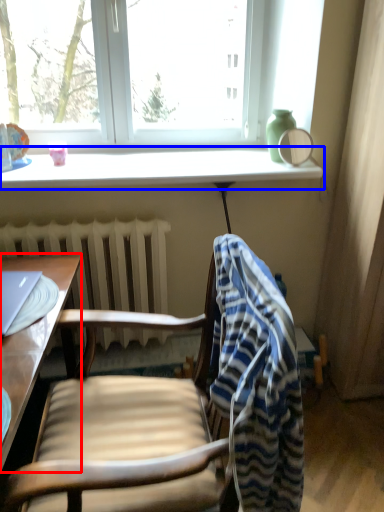
Question: Which point is closer to the camera, desk (highlighted by a red box) or window sill (highlighted by a blue box)?

Choices:
 (A) desk
 (B) window sill

Answer: (A)